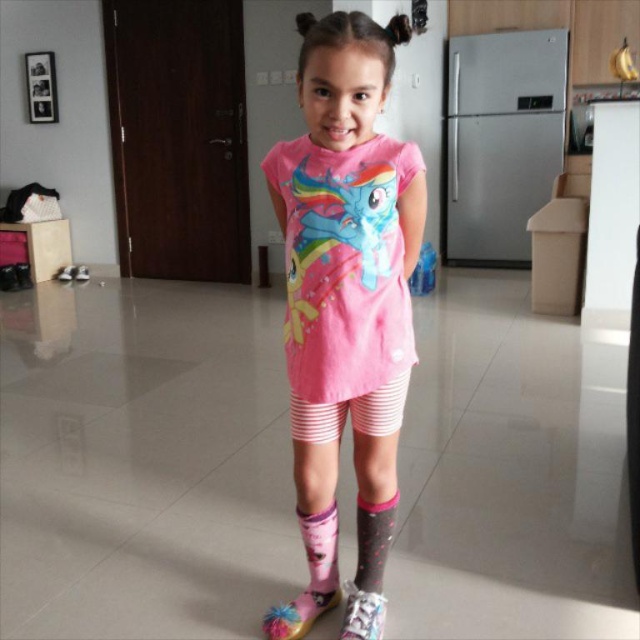
The young girl is wearing a pink fabric dress at center and patterned fabric sock at lower center. Which item of clothing is positioned higher on her body?

The pink fabric dress at center is located above the patterned fabric sock at lower center, so the dress is higher up on her body.

The young girl is standing on a light colored tiled floor. She has two pairs of socks visible at lower center. Which one is higher up, the patterned fabric sock at lower center or the pink dotted socks at lower center?

The patterned fabric sock at lower center is located above the pink dotted socks at lower center, so the patterned fabric sock at lower center is higher up.